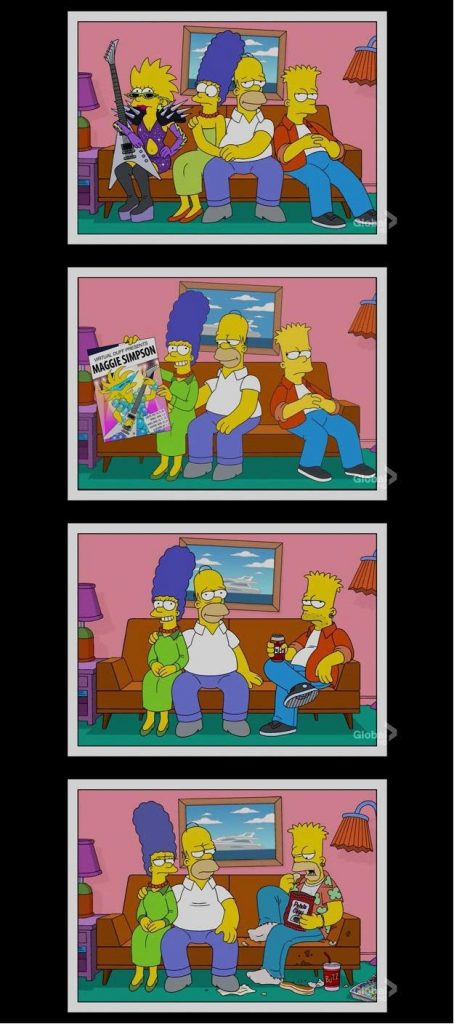
Locate an element on the screen. table lamp is located at coordinates (83, 896), (82, 641), (86, 384), (80, 131).